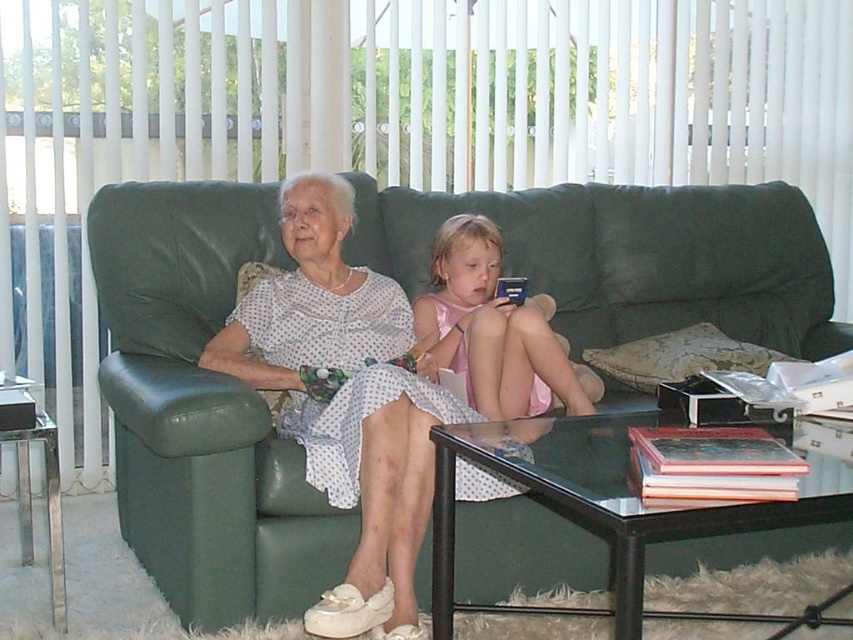
Is green leather couch at center closer to camera compared to pink satin dress at center?

Yes, it is in front of pink satin dress at center.

Find the location of a particular element. The image size is (853, 640). green leather couch at center is located at coordinates (202, 410).

This screenshot has width=853, height=640. Identify the location of green leather couch at center. (202, 410).

Who is shorter, green leather couch at center or matte white dress at center?

green leather couch at center

Is point (457, 545) farther from camera compared to point (367, 388)?

Yes.

You are a GUI agent. You are given a task and a screenshot of the screen. Output one action in this format:
    pyautogui.click(x=<x>, y=<y>)
    Task: Click on the green leather couch at center
    
    Given the screenshot: What is the action you would take?
    pyautogui.click(x=202, y=410)

Does matte white dress at center have a greater width compared to pink satin dress at center?

Correct, the width of matte white dress at center exceeds that of pink satin dress at center.

Does matte white dress at center have a lesser width compared to pink satin dress at center?

No.

Is point (389, 339) farther from camera compared to point (498, 365)?

Yes, point (389, 339) is farther from viewer.

Where is `matte white dress at center`? matte white dress at center is located at coordinates (346, 401).